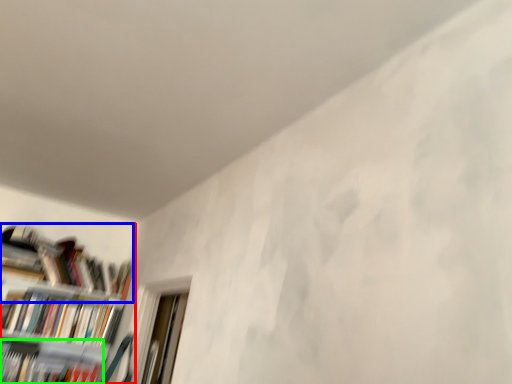
Question: Based on their relative distances, which object is nearer to bookcase (highlighted by a red box)? Choose from book (highlighted by a blue box) and book (highlighted by a green box).

Choices:
 (A) book
 (B) book

Answer: (A)